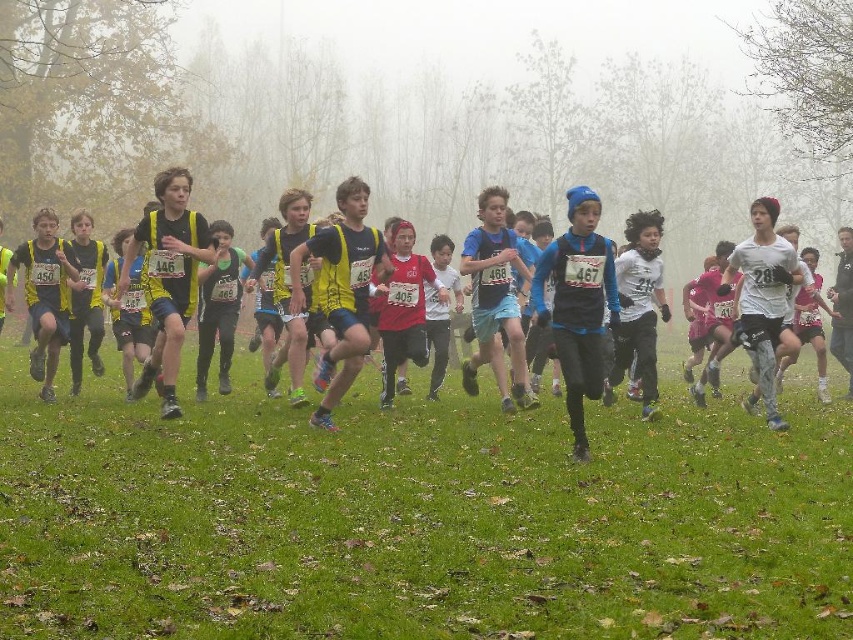
You are a photographer at the cross country race and want to capture a runner wearing a white matte shirt at center. According to the coordinates provided, where should you aim your camera to get the best shot?

You should aim your camera at point (637, 307) to capture the white matte shirt at center.

You are a race official at a cross country event. You need to ensure that the white matte shirt at center and the yellow fabric vest at center are within a 5 meter safety zone for the runners. Are they within the required distance?

The white matte shirt at center and the yellow fabric vest at center are 4.69 meters apart from each other, which is within the 5 meter safety zone requirement.